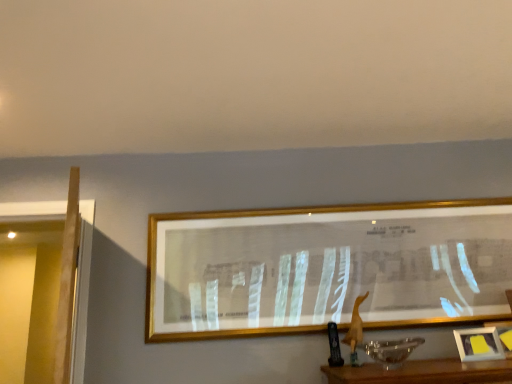
Question: From the image's perspective, is yellow paper at lower right, the 2th picture frame in the left-to-right sequence, above or below gold-framed picture at center, which ranks as the 2th picture frame in front-to-back order?

Choices:
 (A) below
 (B) above

Answer: (A)

Question: Considering the relative positions of yellow paper at lower right, which ranks as the second picture frame in back-to-front order, and gold-framed picture at center, which ranks as the 2th picture frame in front-to-back order, in the image provided, is yellow paper at lower right, which ranks as the second picture frame in back-to-front order, to the left or to the right of gold-framed picture at center, which ranks as the 2th picture frame in front-to-back order,?

Choices:
 (A) right
 (B) left

Answer: (A)

Question: In terms of height, does yellow paper at lower right, the first picture frame positioned from the front, look taller or shorter compared to gold-framed picture at center, acting as the 2th picture frame starting from the right?

Choices:
 (A) short
 (B) tall

Answer: (A)

Question: Is point (241, 228) positioned closer to the camera than point (485, 342)?

Choices:
 (A) farther
 (B) closer

Answer: (A)

Question: Visually, is gold-framed picture at center, acting as the 2th picture frame starting from the right, positioned to the left or to the right of yellow paper at lower right, the first picture frame positioned from the front?

Choices:
 (A) left
 (B) right

Answer: (A)

Question: Do you think gold-framed picture at center, acting as the 2th picture frame starting from the right, is within yellow paper at lower right, the 1th picture frame from the right, or outside of it?

Choices:
 (A) outside
 (B) inside

Answer: (A)

Question: In terms of width, does gold-framed picture at center, which is counted as the first picture frame, starting from the back, look wider or thinner when compared to yellow paper at lower right, which ranks as the second picture frame in back-to-front order?

Choices:
 (A) wide
 (B) thin

Answer: (A)